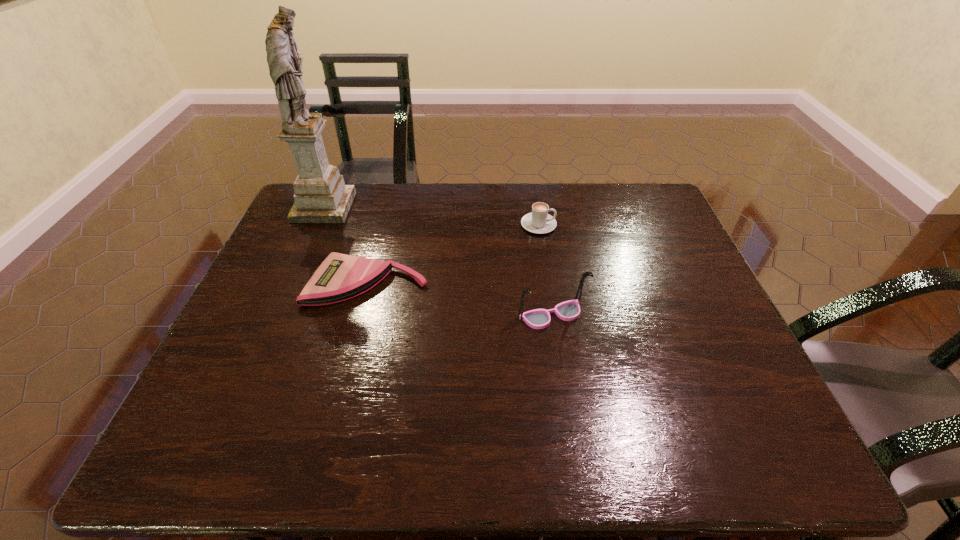
This screenshot has height=540, width=960. In order to click on sculpture that is at the left edge in this screenshot , I will do `click(321, 196)`.

In order to click on wristlet located in the left edge section of the desktop in this screenshot , I will do tap(340, 277).

What are the coordinates of `object that is at the far left corner` in the screenshot? It's located at (321, 196).

This screenshot has height=540, width=960. In order to click on vacant area at the far edge of the desktop in this screenshot , I will do `click(595, 197)`.

Identify the location of vacant space at the near edge of the desktop. (525, 448).

Locate an element on the screen. vacant area at the left edge is located at coordinates (246, 331).

At what (x,y) coordinates should I click in order to perform the action: click on vacant space at the right edge. Please return your answer as a coordinate pair (x, y). Looking at the image, I should click on (687, 386).

The image size is (960, 540). In the image, there is a desktop. What are the coordinates of `vacant space at the far right corner` in the screenshot? It's located at (637, 190).

At what (x,y) coordinates should I click in order to perform the action: click on vacant space that's between the sculpture and the spectacles. Please return your answer as a coordinate pair (x, y). Looking at the image, I should click on (438, 261).

Where is `unoccupied position between the second tallest object and the cappuccino`? The image size is (960, 540). unoccupied position between the second tallest object and the cappuccino is located at coordinates (545, 270).